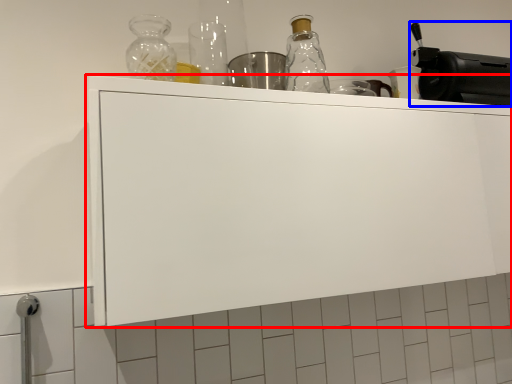
Question: Which of the following is the farthest to the observer, cabinetry (highlighted by a red box) or appliance (highlighted by a blue box)?

Choices:
 (A) cabinetry
 (B) appliance

Answer: (B)